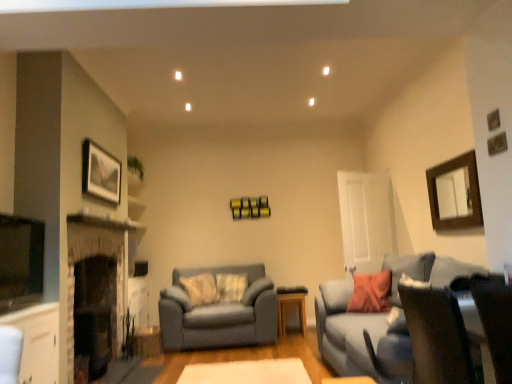
Question: Is wooden mirror at upper right, the second picture frame positioned from the left, with matte gray couch at right, marked as the 2th studio couch in a left-to-right arrangement?

Choices:
 (A) no
 (B) yes

Answer: (A)

Question: From a real-world perspective, does wooden mirror at upper right, which is the first picture frame from right to left, sit lower than matte gray couch at right, marked as the 2th studio couch in a left-to-right arrangement?

Choices:
 (A) no
 (B) yes

Answer: (A)

Question: From the image's perspective, is wooden mirror at upper right, which is the first picture frame from right to left, beneath matte gray couch at right, arranged as the second studio couch when viewed from the back?

Choices:
 (A) no
 (B) yes

Answer: (A)

Question: Can you confirm if wooden mirror at upper right, the second picture frame positioned from the left, is positioned to the left of matte gray couch at right, marked as the 2th studio couch in a left-to-right arrangement?

Choices:
 (A) yes
 (B) no

Answer: (B)

Question: Would you consider wooden mirror at upper right, the second picture frame positioned from the left, to be distant from matte gray couch at right, marked as the 2th studio couch in a left-to-right arrangement?

Choices:
 (A) no
 (B) yes

Answer: (A)

Question: From a real-world perspective, is white felt rug at center positioned above or below matte gray couch at right, marked as the 2th studio couch in a left-to-right arrangement?

Choices:
 (A) above
 (B) below

Answer: (B)

Question: Is white felt rug at center bigger or smaller than matte gray couch at right, arranged as the second studio couch when viewed from the back?

Choices:
 (A) small
 (B) big

Answer: (A)

Question: Based on their positions, is white felt rug at center located to the left or right of matte gray couch at right, acting as the 1th studio couch starting from the front?

Choices:
 (A) left
 (B) right

Answer: (A)

Question: Does point (203, 370) appear closer or farther from the camera than point (344, 304)?

Choices:
 (A) closer
 (B) farther

Answer: (A)

Question: Considering the positions of dark brown leather swivel chair at lower right and white felt rug at center in the image, is dark brown leather swivel chair at lower right taller or shorter than white felt rug at center?

Choices:
 (A) short
 (B) tall

Answer: (B)

Question: From the image's perspective, is dark brown leather swivel chair at lower right above or below white felt rug at center?

Choices:
 (A) above
 (B) below

Answer: (A)

Question: Considering the positions of dark brown leather swivel chair at lower right and white felt rug at center in the image, is dark brown leather swivel chair at lower right wider or thinner than white felt rug at center?

Choices:
 (A) wide
 (B) thin

Answer: (B)

Question: Relative to white felt rug at center, is dark brown leather swivel chair at lower right in front or behind?

Choices:
 (A) front
 (B) behind

Answer: (A)

Question: Choose the correct answer: Is matte gray couch at right, acting as the 1th studio couch starting from the front, inside matte gray couch at center, placed as the first studio couch when sorted from back to front, or outside it?

Choices:
 (A) outside
 (B) inside

Answer: (A)

Question: From a real-world perspective, is matte gray couch at right, arranged as the second studio couch when viewed from the back, positioned above or below matte gray couch at center, the second studio couch positioned from the front?

Choices:
 (A) above
 (B) below

Answer: (A)